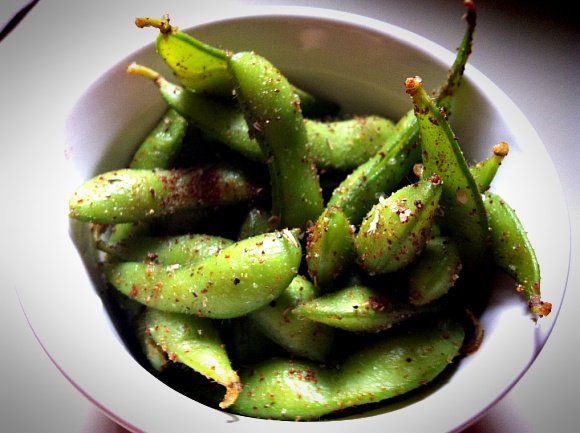
Locate an element on the screen. bowl is located at coordinates (82, 318).